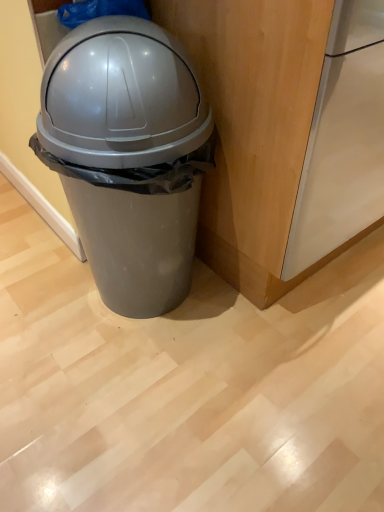
Where is `free space to the left of matte gray plastic trash can at center`? free space to the left of matte gray plastic trash can at center is located at coordinates (42, 326).